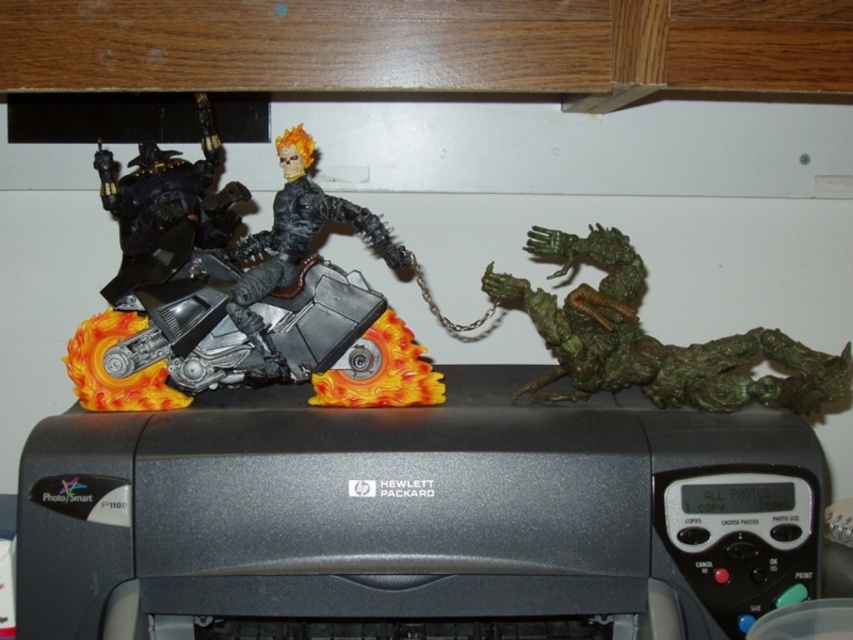
Question: Which of the following is the closest to the observer?

Choices:
 (A) green matte dragon at right
 (B) black plastic printer at center
 (C) black metallic motorcycle at center

Answer: (B)

Question: Does green matte dragon at right have a lesser width compared to matte black motorcycle at left?

Choices:
 (A) yes
 (B) no

Answer: (B)

Question: Is black plastic printer at center above metallic silver motorcycle at left?

Choices:
 (A) yes
 (B) no

Answer: (B)

Question: Which is nearer to the metallic silver motorcycle at left?

Choices:
 (A) black metallic motorcycle at center
 (B) green matte dragon at right

Answer: (A)

Question: Which object is the closest to the black plastic printer at center?

Choices:
 (A) green matte dragon at right
 (B) metallic silver motorcycle at left
 (C) matte black motorcycle at left

Answer: (B)

Question: Is metallic silver motorcycle at left to the left of black metallic motorcycle at center from the viewer's perspective?

Choices:
 (A) no
 (B) yes

Answer: (B)